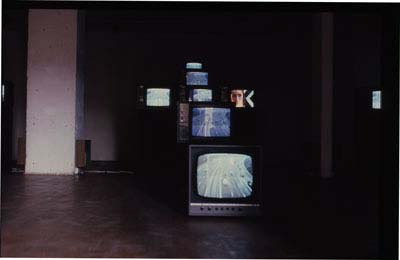
The image size is (400, 260). Find the location of `wall`. wall is located at coordinates (33, 105).